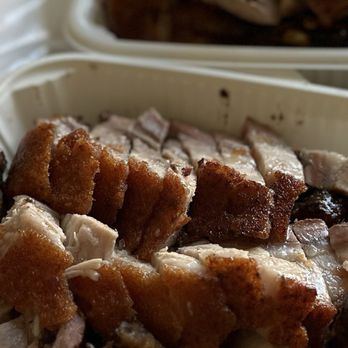
I want to click on empty space on tray top left, so click(x=25, y=29).